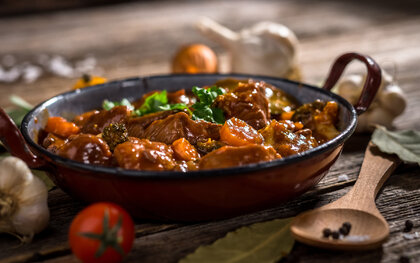
Where is `dish inside skillet`? This screenshot has height=263, width=420. dish inside skillet is located at coordinates (183, 129).